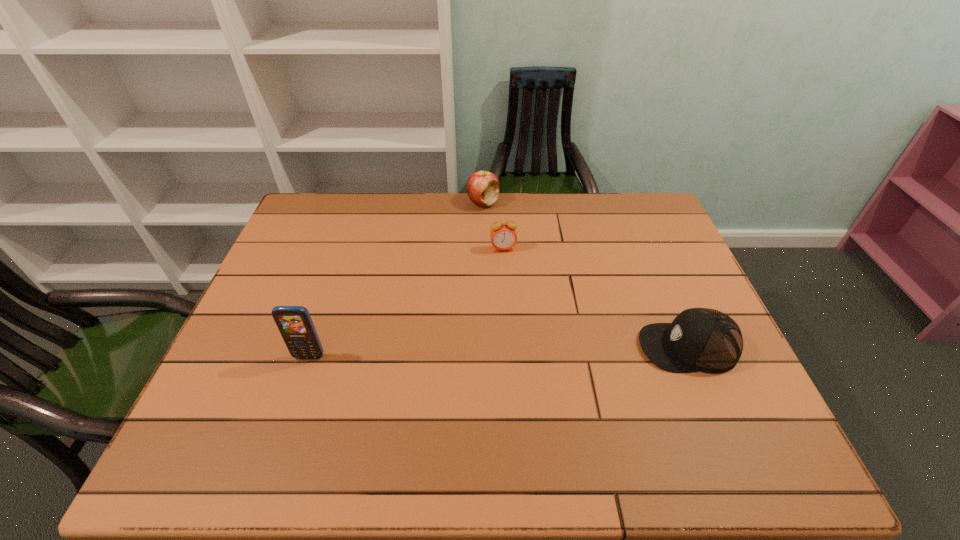
This screenshot has width=960, height=540. What are the coordinates of `vacant area located on the face of the alarm clock` in the screenshot? It's located at (506, 264).

This screenshot has width=960, height=540. I want to click on vacant area situated on the face of the alarm clock, so (508, 273).

Where is `free space located on the bitten side of the farthest object`? The width and height of the screenshot is (960, 540). free space located on the bitten side of the farthest object is located at coordinates point(484,252).

Where is `vacant space situated 0.390m on the bitten side of the farthest object`? The width and height of the screenshot is (960, 540). vacant space situated 0.390m on the bitten side of the farthest object is located at coordinates (485, 294).

Locate an element on the screen. free space located 0.380m on the bitten side of the farthest object is located at coordinates (485, 292).

At what (x,y) coordinates should I click in order to perform the action: click on object positioned at the far edge. Please return your answer as a coordinate pair (x, y). The height and width of the screenshot is (540, 960). Looking at the image, I should click on (482, 187).

This screenshot has height=540, width=960. What are the coordinates of `object that is at the left edge` in the screenshot? It's located at (295, 325).

Where is `object that is at the right edge`? Image resolution: width=960 pixels, height=540 pixels. object that is at the right edge is located at coordinates (699, 339).

Where is `free space at the far edge of the desktop`? The height and width of the screenshot is (540, 960). free space at the far edge of the desktop is located at coordinates (569, 202).

Where is `vacant space at the near edge of the desktop`? vacant space at the near edge of the desktop is located at coordinates (340, 421).